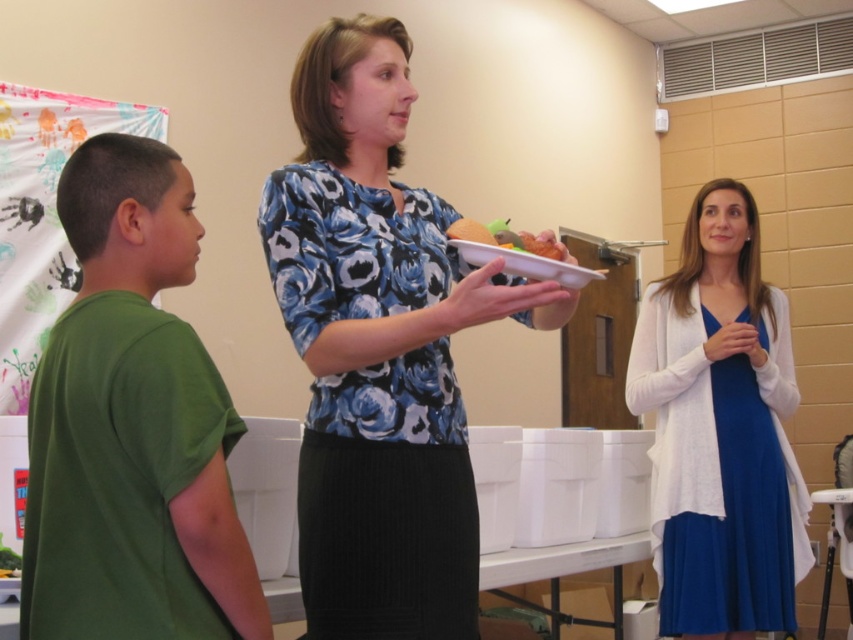
Question: Which object is farther from the camera taking this photo?

Choices:
 (A) green matte t-shirt at left
 (B) floral-patterned blouse at center
 (C) blue satin dress at right

Answer: (C)

Question: Which is nearer to the blue satin dress at right?

Choices:
 (A) floral-patterned blouse at center
 (B) smooth yellow bun at center

Answer: (A)

Question: Which point is farther from the camera taking this photo?

Choices:
 (A) (770, 291)
 (B) (202, 634)

Answer: (A)

Question: Can you confirm if floral-patterned blouse at center is positioned to the left of smooth yellow bun at center?

Choices:
 (A) yes
 (B) no

Answer: (A)

Question: Is floral-patterned blouse at center smaller than smooth yellow bun at center?

Choices:
 (A) no
 (B) yes

Answer: (A)

Question: Can you confirm if floral-patterned blouse at center is bigger than smooth yellow bun at center?

Choices:
 (A) no
 (B) yes

Answer: (B)